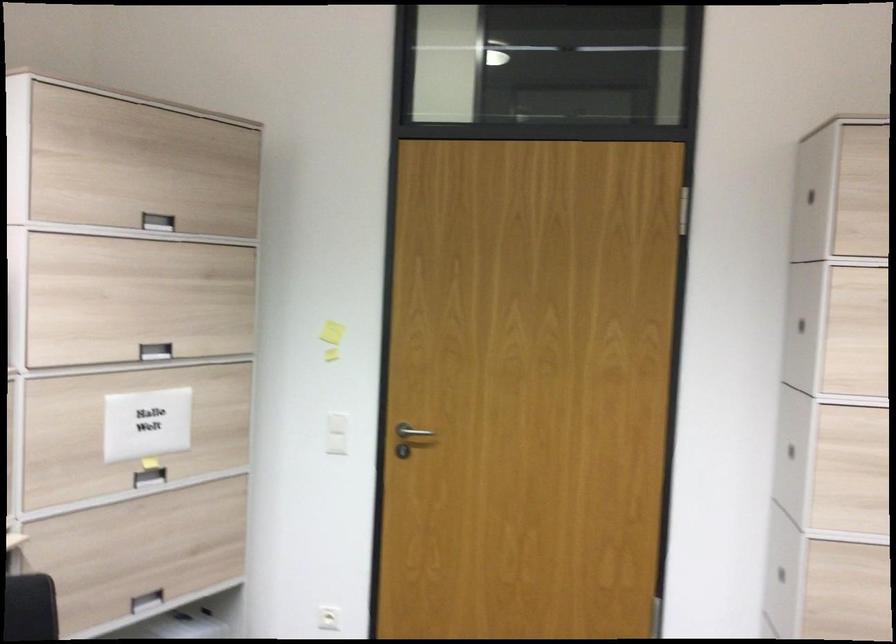
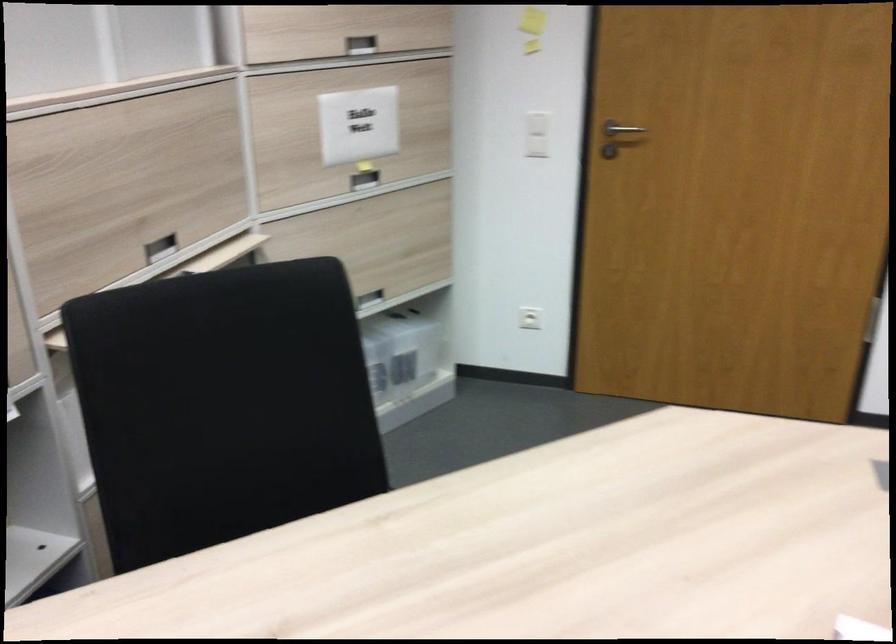
Find the pixel in the second image that matches point 149,476 in the first image.

(364, 180)